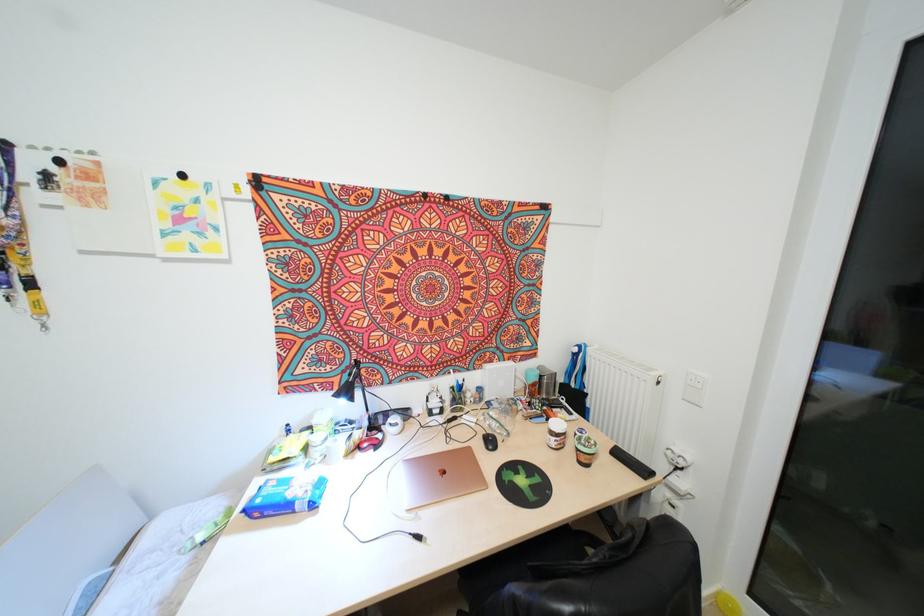
Locate an element on the screen. blue wipes package is located at coordinates (286, 496).